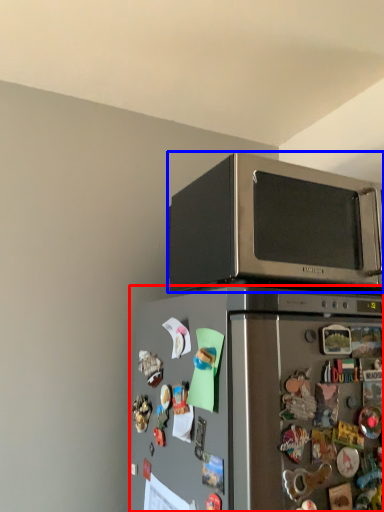
Question: Which object appears closest to the camera in this image, refrigerator (highlighted by a red box) or microwave oven (highlighted by a blue box)?

Choices:
 (A) refrigerator
 (B) microwave oven

Answer: (A)